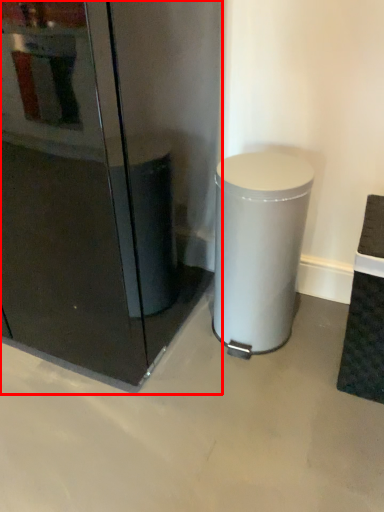
Question: From the image's perspective, where is fridge (annotated by the red box) located relative to waste container?

Choices:
 (A) above
 (B) below

Answer: (A)